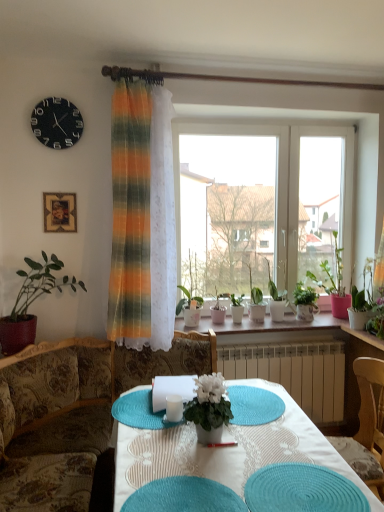
Question: Which is correct: teal fabric placemat at lower center is inside green glossy plant at right, or outside of it?

Choices:
 (A) outside
 (B) inside

Answer: (A)

Question: In the image, is teal fabric placemat at lower center positioned in front of or behind green glossy plant at right?

Choices:
 (A) behind
 (B) front

Answer: (B)

Question: Based on their relative distances, which object is farther from the blue woven placemat at center?

Choices:
 (A) wooden frame at upper left
 (B) green glossy plant at upper center, marked as the 6th houseplant in a front-to-back arrangement
 (C) teal woven placemat at center
 (D) white ceramic pots at center
 (E) white fabric table at center

Answer: (A)

Question: Considering the real-world distances, which object is closest to the teal woven placemat at center?

Choices:
 (A) black matte clock at upper left
 (B) teal fabric placemat at lower center
 (C) white ceramic pots at center
 (D) green matte plant at center, which is the 2th houseplant in back-to-front order
 (E) wooden frame at upper left

Answer: (B)